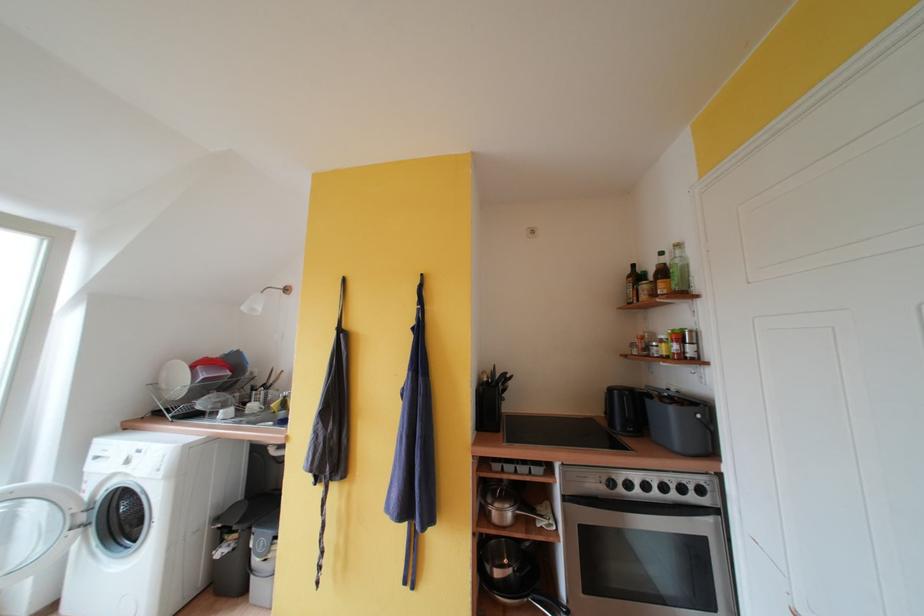
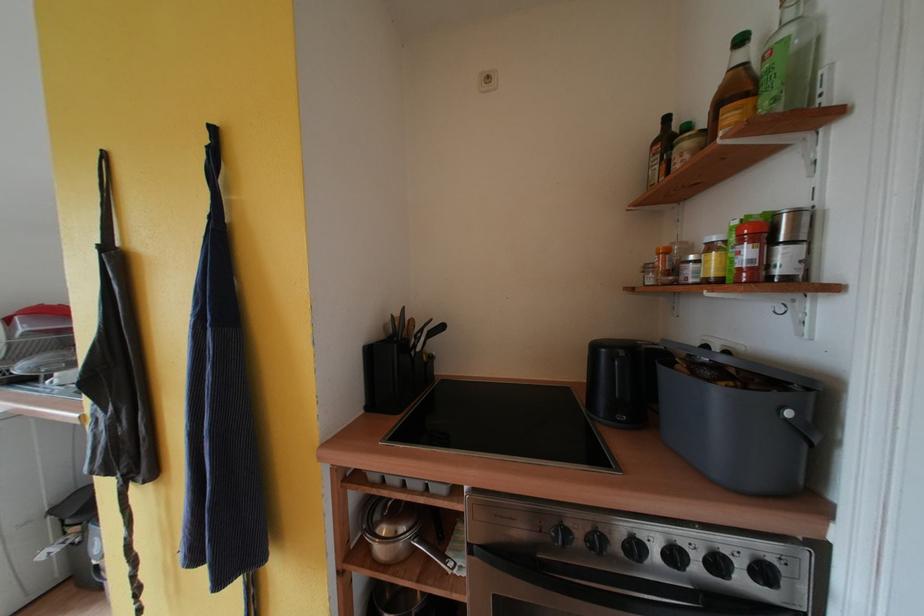
Locate, in the second image, the point that corresponds to point 682,350 in the first image.

(755, 256)